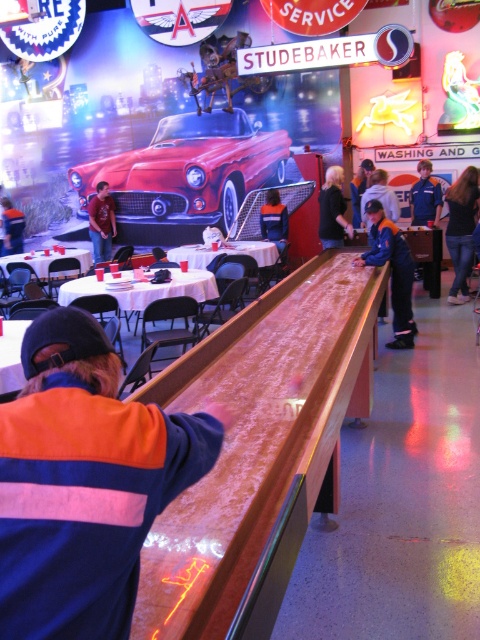
Can you confirm if matte red car at center is bigger than wooden bar at center?

Yes, matte red car at center is bigger than wooden bar at center.

This screenshot has height=640, width=480. Identify the location of matte red car at center. (187, 173).

Can you confirm if wooden table at center is smaller than matte red car at center?

Yes.

Is point (314, 404) closer to camera compared to point (216, 205)?

That is True.

In order to click on wooden table at center in this screenshot , I will do `click(260, 451)`.

Can you confirm if orange and blue jacket at center is taller than white plastic table at center?

Yes.

Is orange and blue jacket at center shorter than white plastic table at center?

Incorrect, orange and blue jacket at center's height does not fall short of white plastic table at center's.

Between point (162, 504) and point (75, 282), which one is positioned in front?

Point (162, 504)

The height and width of the screenshot is (640, 480). Find the location of `orange and blue jacket at center`. orange and blue jacket at center is located at coordinates (84, 483).